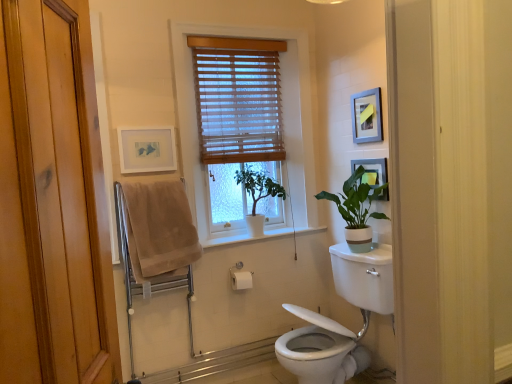
Question: In terms of size, does green matte plant at center, which appears as the second houseplant when viewed from the right, appear bigger or smaller than silver metallic picture frame at upper right, the 2th picture frame viewed from the right?

Choices:
 (A) small
 (B) big

Answer: (B)

Question: Based on their positions, is green matte plant at center, which appears as the second houseplant when viewed from the right, located to the left or right of silver metallic picture frame at upper right, positioned as the 2th picture frame in left-to-right order?

Choices:
 (A) right
 (B) left

Answer: (B)

Question: Based on their relative distances, which object is nearer to the matte white picture frame at upper left, positioned as the 3th picture frame in right-to-left order?

Choices:
 (A) matte black picture frame at upper right, which is the 3th picture frame from left to right
 (B) white glossy toilet at lower right
 (C) wooden blinds at center
 (D) green matte plant at center, the first houseplant positioned from the left
 (E) silver metallic picture frame at upper right, positioned as the 2th picture frame in left-to-right order

Answer: (C)

Question: Which object is the closest to the green matte plant at center, the first houseplant positioned from the left?

Choices:
 (A) matte black picture frame at upper right, which is the 3th picture frame from left to right
 (B) matte white picture frame at upper left, the 1th picture frame in the left-to-right sequence
 (C) wooden blinds at center
 (D) beige cotton bath towel at left
 (E) white glossy toilet at lower right

Answer: (C)